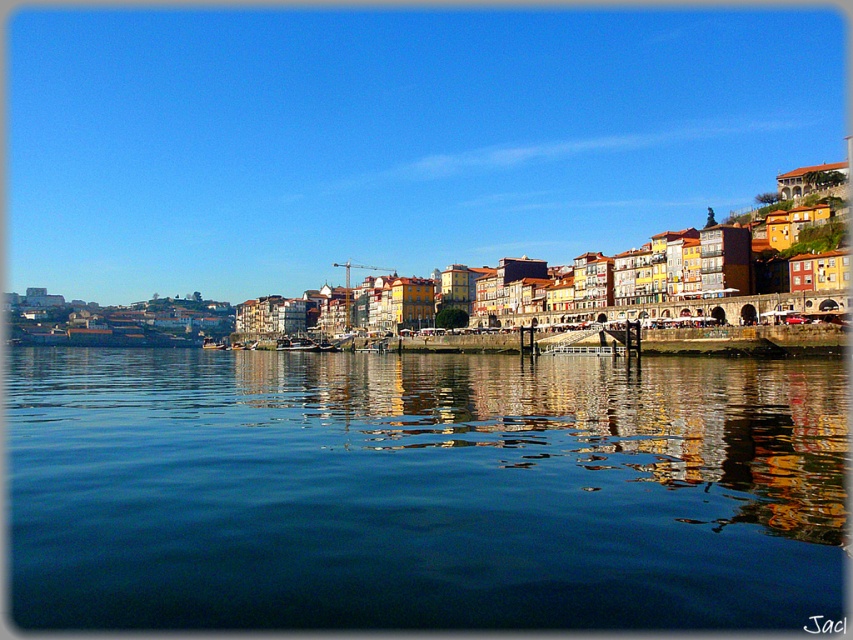
Question: Which of the following is the closest to the observer?

Choices:
 (A) pos(207,348)
 (B) pos(281,340)
 (C) pos(305,579)

Answer: (C)

Question: Which object is the farthest from the wooden boat at lower left?

Choices:
 (A) transparent blue water at center
 (B) wooden boat at center

Answer: (A)

Question: Is transparent blue water at center positioned in front of wooden boat at lower left?

Choices:
 (A) yes
 (B) no

Answer: (A)

Question: Does transparent blue water at center have a smaller size compared to wooden boat at lower left?

Choices:
 (A) no
 (B) yes

Answer: (A)

Question: Considering the real-world distances, which object is closest to the wooden boat at lower left?

Choices:
 (A) wooden boat at center
 (B) transparent blue water at center

Answer: (A)

Question: Does transparent blue water at center appear under wooden boat at center?

Choices:
 (A) no
 (B) yes

Answer: (B)